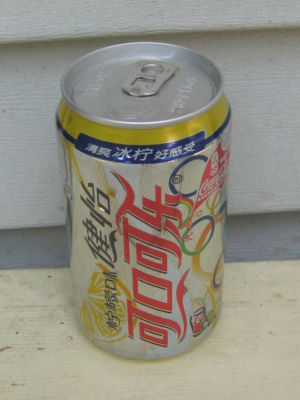
Identify the location of wooden bench. The width and height of the screenshot is (300, 400). (18, 307).